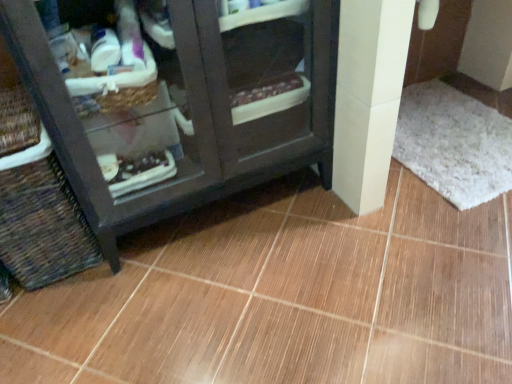
I want to click on vacant area that is in front of woven brown basket at lower left, so click(x=61, y=318).